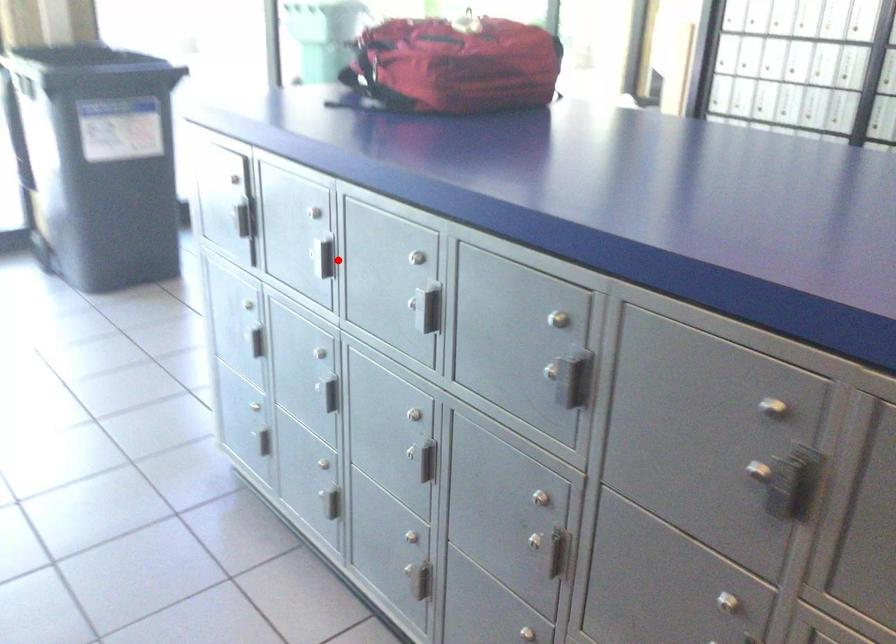
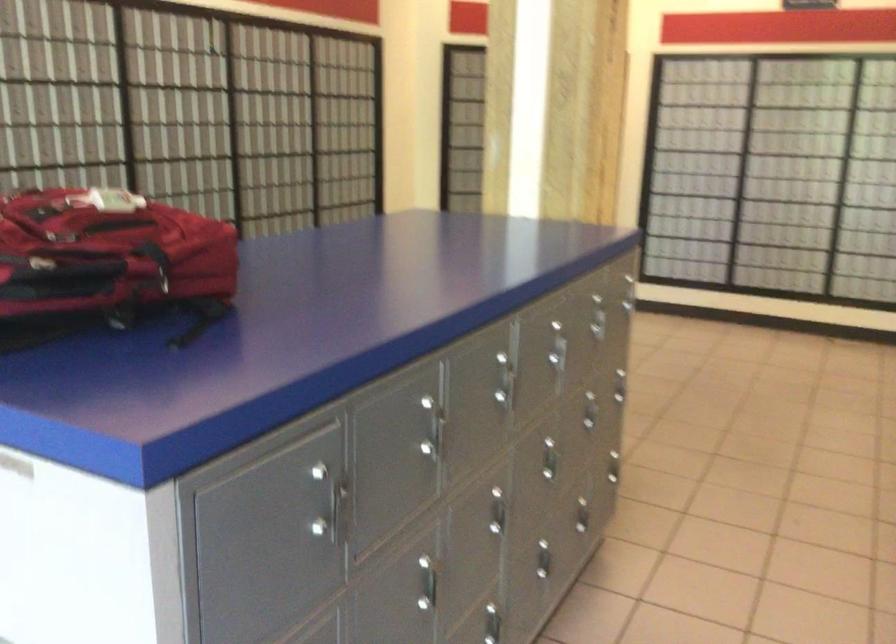
Locate, in the second image, the point that corresponds to the highlighted location in the first image.

(444, 431)